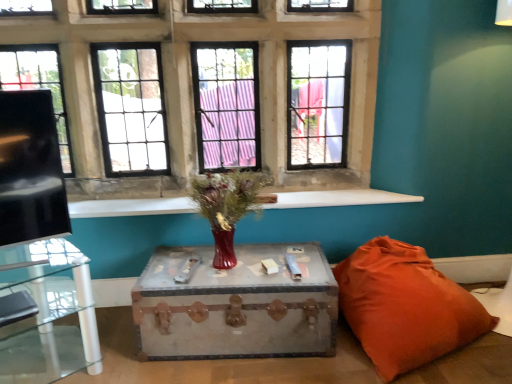
Question: Considering the relative sizes of clear glass table at left, the 2th table when ordered from right to left, and matte glass vase at center in the image provided, is clear glass table at left, the 2th table when ordered from right to left, bigger than matte glass vase at center?

Choices:
 (A) no
 (B) yes

Answer: (B)

Question: Is clear glass table at left, the 2th table when ordered from right to left, with matte glass vase at center?

Choices:
 (A) no
 (B) yes

Answer: (A)

Question: Does clear glass table at left, which is counted as the first table, starting from the left, appear on the left side of matte glass vase at center?

Choices:
 (A) yes
 (B) no

Answer: (A)

Question: From the image's perspective, is clear glass table at left, which is counted as the first table, starting from the left, beneath matte glass vase at center?

Choices:
 (A) yes
 (B) no

Answer: (A)

Question: Considering the relative sizes of clear glass table at left, the 2th table when ordered from right to left, and matte glass vase at center in the image provided, is clear glass table at left, the 2th table when ordered from right to left, smaller than matte glass vase at center?

Choices:
 (A) no
 (B) yes

Answer: (A)

Question: Is clear glass table at left, the 2th table when ordered from right to left, at the right side of matte glass vase at center?

Choices:
 (A) no
 (B) yes

Answer: (A)

Question: Can you confirm if matte glass window at center is thinner than clear glass table at left, the 2th table when ordered from right to left?

Choices:
 (A) yes
 (B) no

Answer: (A)

Question: Is clear glass table at left, the 2th table when ordered from right to left, surrounded by matte glass window at center?

Choices:
 (A) yes
 (B) no

Answer: (B)

Question: Could you tell me if matte glass window at center is turned towards clear glass table at left, which is counted as the first table, starting from the left?

Choices:
 (A) no
 (B) yes

Answer: (A)

Question: Is the position of matte glass window at center less distant than that of clear glass table at left, which is counted as the first table, starting from the left?

Choices:
 (A) no
 (B) yes

Answer: (A)

Question: From the image's perspective, does matte glass window at center appear higher than clear glass table at left, which is counted as the first table, starting from the left?

Choices:
 (A) no
 (B) yes

Answer: (B)

Question: Is matte glass window at center smaller than clear glass table at left, which is counted as the first table, starting from the left?

Choices:
 (A) no
 (B) yes

Answer: (A)

Question: Is matte glass vase at center bigger than orange fabric pillow at lower right?

Choices:
 (A) no
 (B) yes

Answer: (A)